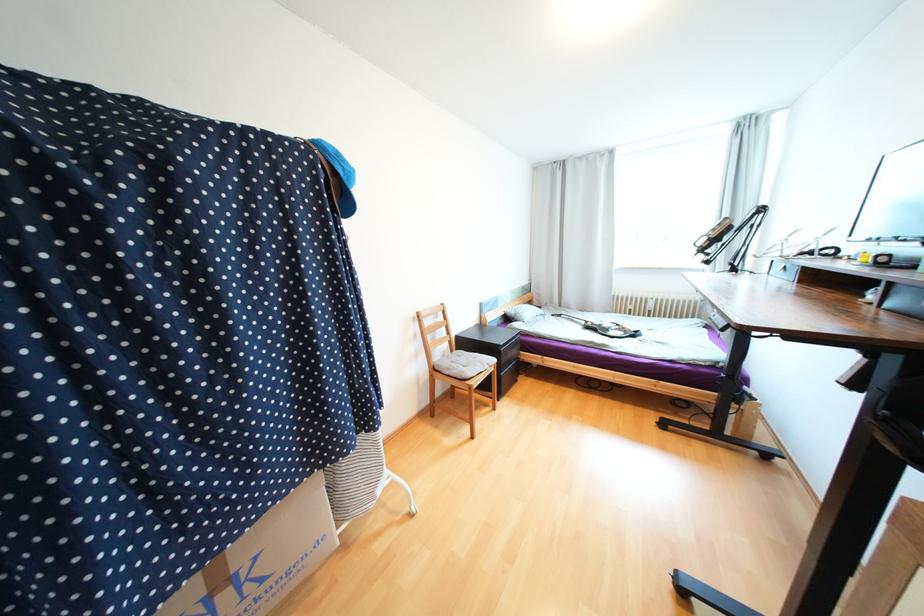
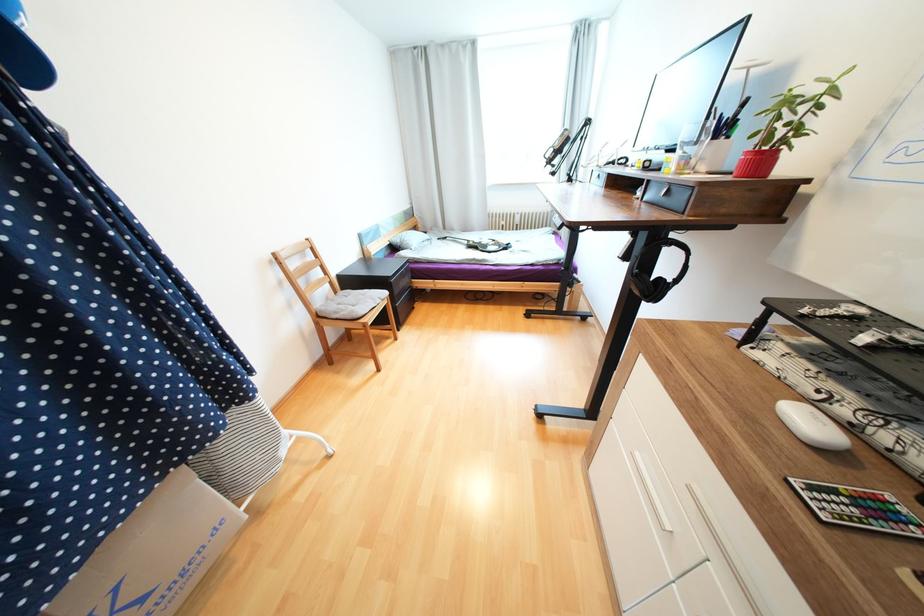
Find the pixel in the second image that matches (x=488, y=363) in the first image.

(379, 300)